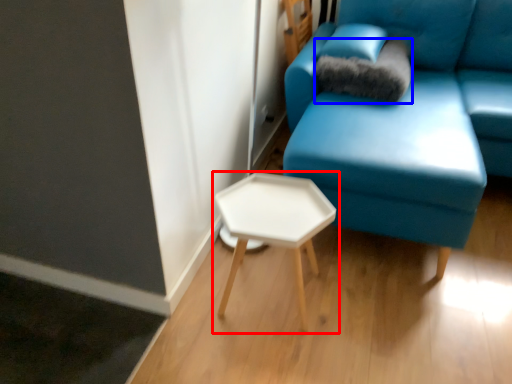
Question: Which of the following is the closest to the observer, table (highlighted by a red box) or pillow (highlighted by a blue box)?

Choices:
 (A) table
 (B) pillow

Answer: (A)